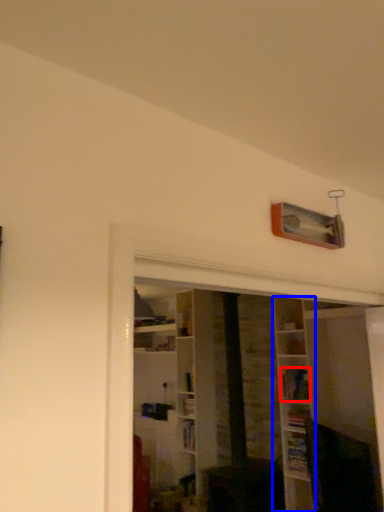
Question: Which point is further to the camera, book (highlighted by a red box) or shelf (highlighted by a blue box)?

Choices:
 (A) book
 (B) shelf

Answer: (A)